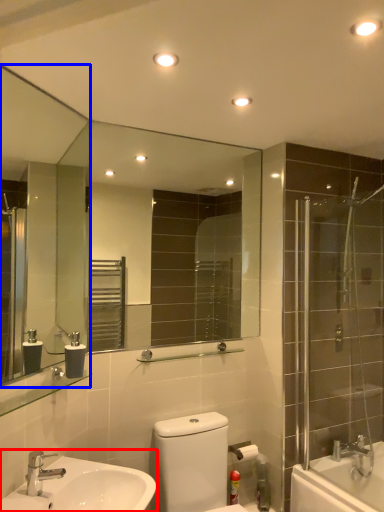
Question: Which object appears farthest to the camera in this image, sink (highlighted by a red box) or mirror (highlighted by a blue box)?

Choices:
 (A) sink
 (B) mirror

Answer: (B)